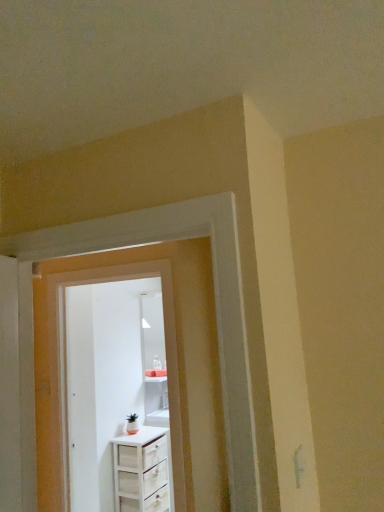
Question: From the image's perspective, does white wood chest of drawers at center appear lower than white wood door at center, the first door from the back?

Choices:
 (A) yes
 (B) no

Answer: (A)

Question: Is white wood chest of drawers at center looking in the opposite direction of white wood door at center, the second door viewed from the front?

Choices:
 (A) no
 (B) yes

Answer: (A)

Question: Is white wood door at center, the first door from the back, located within white wood chest of drawers at center?

Choices:
 (A) no
 (B) yes

Answer: (A)

Question: Does white wood chest of drawers at center have a lesser height compared to white wood door at center, the second door viewed from the front?

Choices:
 (A) yes
 (B) no

Answer: (A)

Question: Considering the relative positions of white wood chest of drawers at center and white wood door at center, the first door from the back, in the image provided, is white wood chest of drawers at center to the left of white wood door at center, the first door from the back, from the viewer's perspective?

Choices:
 (A) no
 (B) yes

Answer: (A)

Question: In terms of width, does white wood chest of drawers at center look wider or thinner when compared to white wood door at center, the second door viewed from the front?

Choices:
 (A) thin
 (B) wide

Answer: (B)

Question: Considering the positions of point (127, 508) and point (91, 463), is point (127, 508) closer or farther from the camera than point (91, 463)?

Choices:
 (A) closer
 (B) farther

Answer: (B)

Question: Visually, is white wood chest of drawers at center positioned to the left or to the right of white wood door at center, the second door viewed from the front?

Choices:
 (A) right
 (B) left

Answer: (A)

Question: Is white wood chest of drawers at center inside the boundaries of white wood door at center, the first door from the back, or outside?

Choices:
 (A) inside
 (B) outside

Answer: (B)

Question: In terms of width, does white wood chest of drawers at center look wider or thinner when compared to white glossy door at center, the second door positioned from the back?

Choices:
 (A) thin
 (B) wide

Answer: (B)

Question: Is white wood chest of drawers at center taller or shorter than white glossy door at center, the 1th door in the front-to-back sequence?

Choices:
 (A) short
 (B) tall

Answer: (A)

Question: Based on their positions, is white wood chest of drawers at center located to the left or right of white glossy door at center, the 1th door in the front-to-back sequence?

Choices:
 (A) right
 (B) left

Answer: (A)

Question: Based on their sizes in the image, would you say white wood chest of drawers at center is bigger or smaller than white glossy door at center, the 1th door in the front-to-back sequence?

Choices:
 (A) small
 (B) big

Answer: (B)

Question: In the image, is white wood door at center, the second door viewed from the front, positioned in front of or behind white wood chest of drawers at center?

Choices:
 (A) front
 (B) behind

Answer: (A)

Question: From a real-world perspective, is white wood door at center, the first door from the back, physically located above or below white wood chest of drawers at center?

Choices:
 (A) above
 (B) below

Answer: (A)